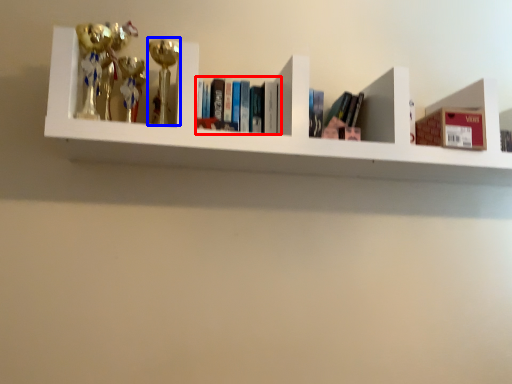
Question: Among these objects, which one is nearest to the camera, book (highlighted by a red box) or toy (highlighted by a blue box)?

Choices:
 (A) book
 (B) toy

Answer: (B)